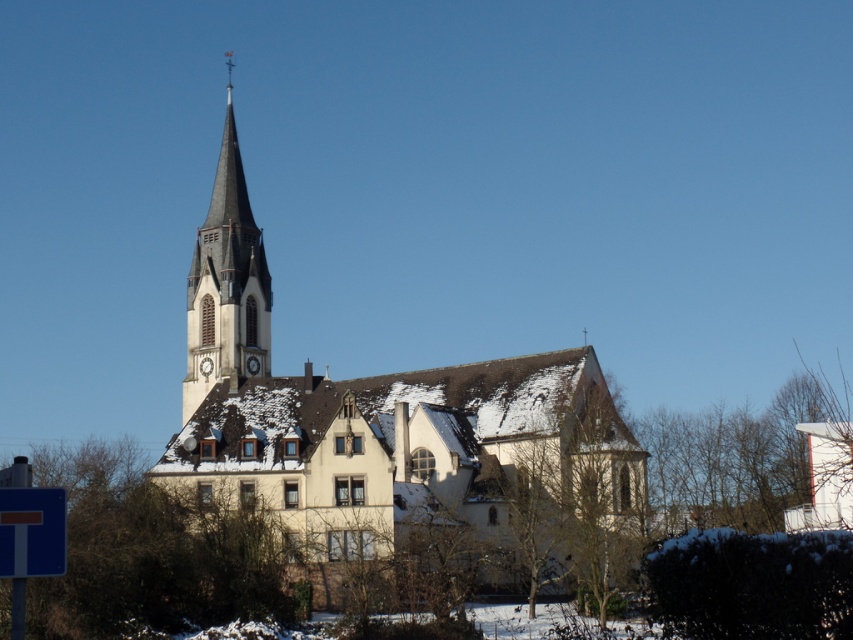
Question: Can you confirm if white stone church at center is positioned to the right of blue plastic sign at lower left?

Choices:
 (A) yes
 (B) no

Answer: (B)

Question: Which object is positioned farthest from the smooth gray steeple at center-left?

Choices:
 (A) white stone church at center
 (B) blue plastic sign at lower left

Answer: (B)

Question: Is white stone church at center thinner than smooth gray steeple at center-left?

Choices:
 (A) yes
 (B) no

Answer: (B)

Question: Which object is closer to the camera taking this photo?

Choices:
 (A) blue plastic sign at lower left
 (B) white stone church at center

Answer: (A)

Question: Based on their relative distances, which object is nearer to the blue plastic sign at lower left?

Choices:
 (A) white stone church at center
 (B) smooth gray steeple at center-left

Answer: (A)

Question: Is white stone church at center closer to the viewer compared to smooth gray steeple at center-left?

Choices:
 (A) no
 (B) yes

Answer: (B)